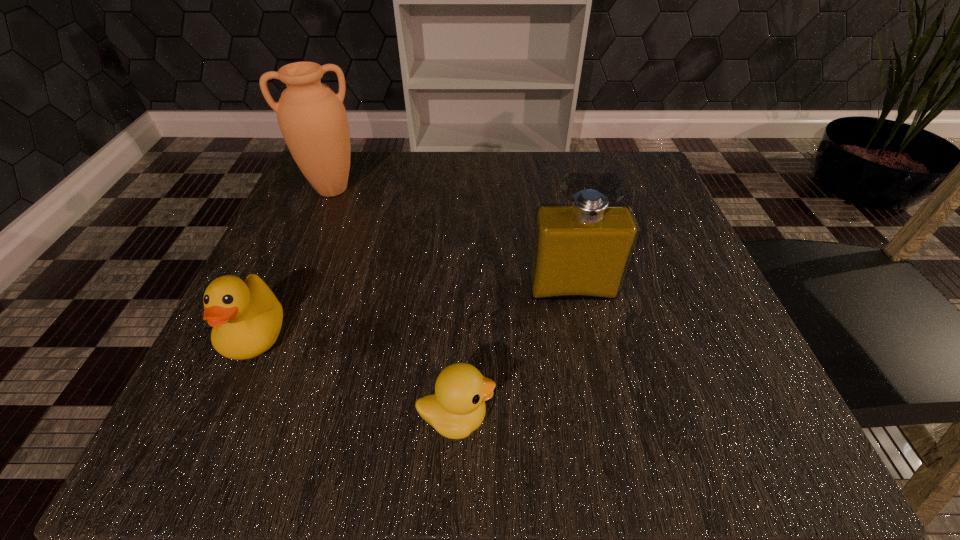
Locate an element on the screen. urn is located at coordinates (312, 118).

This screenshot has height=540, width=960. What are the coordinates of `the farthest object` in the screenshot? It's located at (312, 118).

You are a GUI agent. You are given a task and a screenshot of the screen. Output one action in this format:
    pyautogui.click(x=<x>, y=<y>)
    Task: Click on the third nearest object
    
    Given the screenshot: What is the action you would take?
    pyautogui.click(x=581, y=251)

Locate an element on the screen. This screenshot has width=960, height=540. the second tallest object is located at coordinates (581, 251).

Find the location of `the farther duck`. the farther duck is located at coordinates (246, 318).

The width and height of the screenshot is (960, 540). I want to click on the left duck, so click(246, 318).

The height and width of the screenshot is (540, 960). In order to click on the shortest object in this screenshot , I will do `click(457, 408)`.

At what (x,y) coordinates should I click in order to perform the action: click on the shorter duck. Please return your answer as a coordinate pair (x, y). This screenshot has height=540, width=960. Looking at the image, I should click on (457, 408).

This screenshot has height=540, width=960. Find the location of `blank area located on the right of the urn`. blank area located on the right of the urn is located at coordinates click(x=435, y=189).

This screenshot has height=540, width=960. What are the coordinates of `blank area located on the front-facing side of the third nearest object` in the screenshot? It's located at (588, 373).